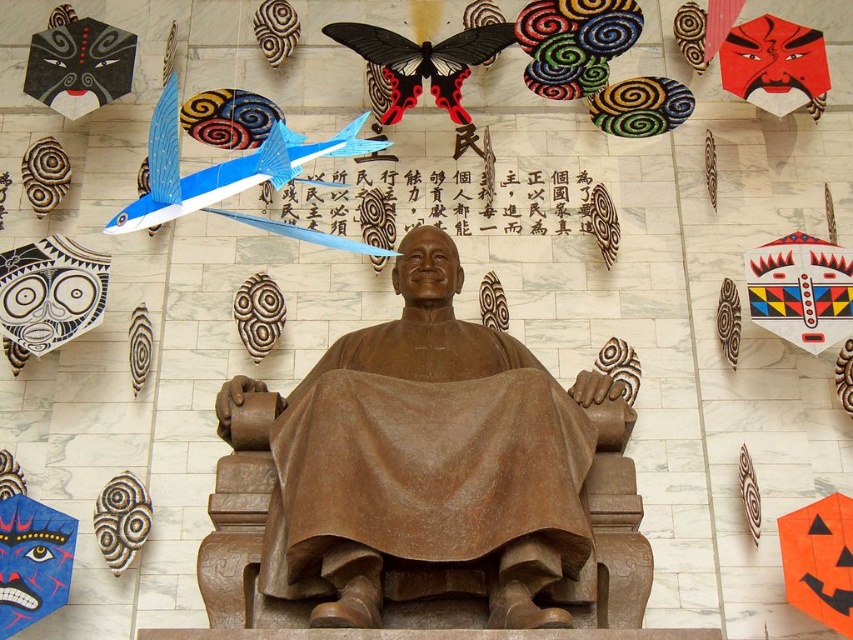
You are standing in front of the bronze statue and want to touch two specific points on the wall behind it. The first point is labeled as point [479,566] and the second is point [134,486]. Which point will require you to reach further back to touch?

Point [134,486] will require reaching further back because it is farther from the viewer compared to point [479,566], which is closer.

You are an art curator planning to display a new sculpture in the gallery. The sculpture requires a space wider than the bronze statue at center. Can the red matte mask at upper right provide enough width for the sculpture?

The bronze statue at center is wider than the red matte mask at upper right. Therefore, the red matte mask at upper right does not provide enough width for the sculpture that requires space wider than the bronze statue at center.